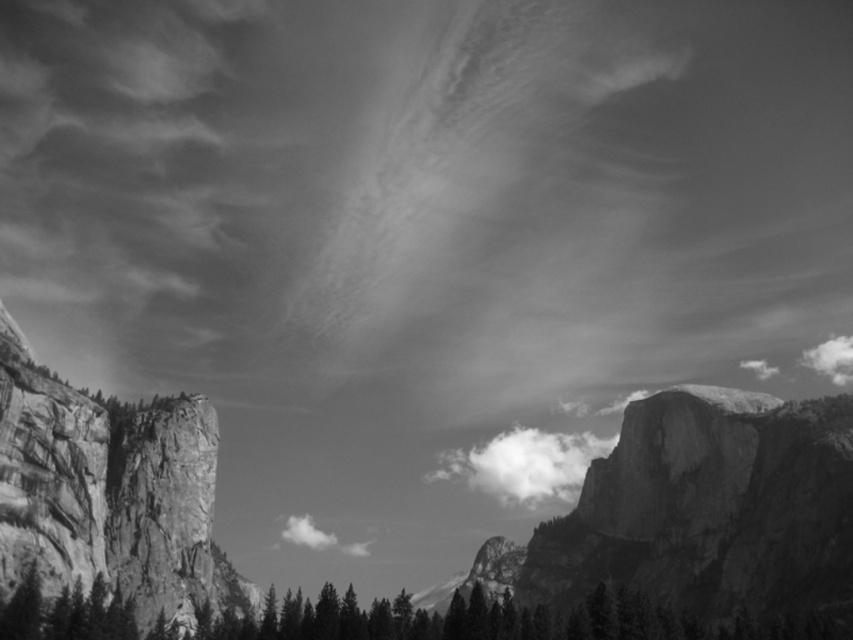
Question: Observing the image, what is the correct spatial positioning of smooth dark green trees at lower center in reference to white fluffy cloud at upper right?

Choices:
 (A) left
 (B) right

Answer: (A)

Question: Observing the image, what is the correct spatial positioning of white fluffy cloud at center in reference to white cotton cloud at center?

Choices:
 (A) below
 (B) above

Answer: (B)

Question: Which of these objects is positioned farthest from the white fluffy cloud at upper right?

Choices:
 (A) white cotton cloud at center
 (B) smooth dark green trees at lower center

Answer: (B)

Question: Which point appears farthest from the camera in this image?

Choices:
 (A) tap(503, 600)
 (B) tap(837, 353)
 (C) tap(300, 532)

Answer: (B)

Question: Can you confirm if smooth dark green trees at lower center is positioned below white fluffy cloud at center?

Choices:
 (A) no
 (B) yes

Answer: (A)

Question: Which point is closer to the camera taking this photo?

Choices:
 (A) (508, 596)
 (B) (515, 468)
 (C) (318, 532)

Answer: (A)